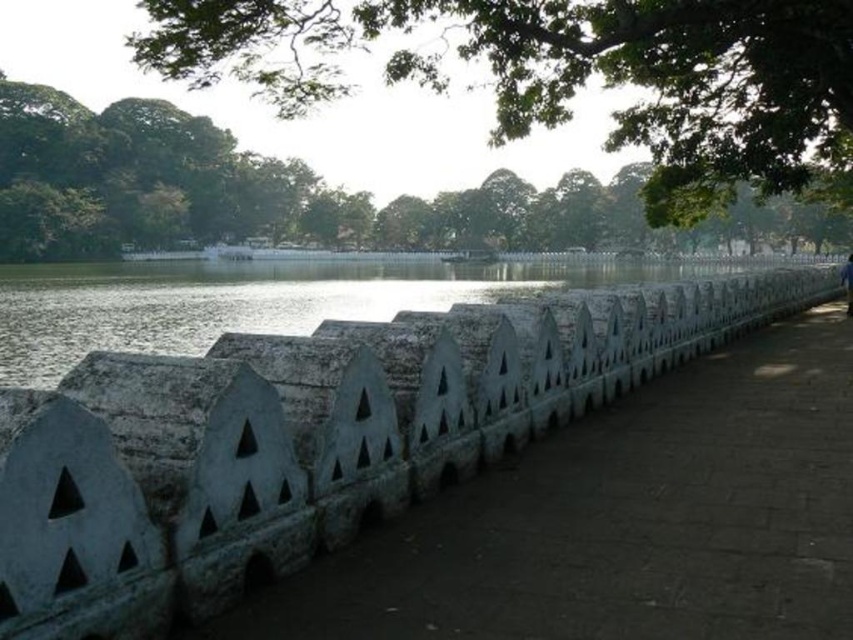
You are standing at the entrance of the park and see the white stone fence at center. Can you determine if the fence is positioned closer to the lake or the trees based on its coordinates?

The white stone fence at center is located at point (310, 438), which places it closer to the lake since the coordinates suggest it is positioned towards the lower part of the image where the lake is situated.

From the picture: You are a photographer standing at the edge of the lake. You want to capture a photo where the white stone fence at center and the blue fabric person at center are both visible in the frame. Considering their sizes, which object should you position closer to the camera to ensure both are fully visible?

The white stone fence at center is much taller than the blue fabric person at center. To ensure both are fully visible in the photo, position the blue fabric person at center closer to the camera so that their height matches the fence in the frame.

You are a visitor walking along the stone pathway and want to take a photo of the white stone fence at center and the green leafy tree at upper center. Which object is closer to you, the photographer, so that it appears larger in the photo?

The white stone fence at center is positioned under the green leafy tree at upper center, meaning the white stone fence at center is closer to you. Therefore, the white stone fence at center will appear larger in the photo.